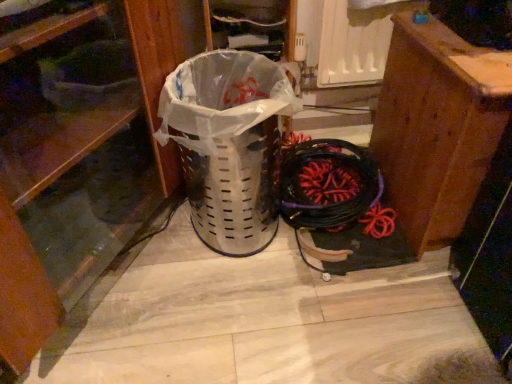
Question: Should I look upward or downward to see brushed wood dresser at left?

Choices:
 (A) up
 (B) down

Answer: (A)

Question: Does brown wood cabinet at right come behind brushed wood dresser at left?

Choices:
 (A) no
 (B) yes

Answer: (B)

Question: Is brown wood cabinet at right at the right side of brushed wood dresser at left?

Choices:
 (A) yes
 (B) no

Answer: (A)

Question: Does brown wood cabinet at right turn towards brushed wood dresser at left?

Choices:
 (A) yes
 (B) no

Answer: (B)

Question: Is brushed wood dresser at left inside brown wood cabinet at right?

Choices:
 (A) no
 (B) yes

Answer: (A)

Question: Is brown wood cabinet at right bigger than brushed wood dresser at left?

Choices:
 (A) yes
 (B) no

Answer: (B)

Question: Is brown wood cabinet at right to the left of brushed wood dresser at left from the viewer's perspective?

Choices:
 (A) yes
 (B) no

Answer: (B)

Question: From a real-world perspective, is brushed wood dresser at left positioned under brown wood cabinet at right based on gravity?

Choices:
 (A) no
 (B) yes

Answer: (A)

Question: Is brushed wood dresser at left far from brown wood cabinet at right?

Choices:
 (A) yes
 (B) no

Answer: (B)

Question: Is brushed wood dresser at left placed right next to brown wood cabinet at right?

Choices:
 (A) no
 (B) yes

Answer: (A)

Question: Can you confirm if brushed wood dresser at left is thinner than brown wood cabinet at right?

Choices:
 (A) no
 (B) yes

Answer: (A)

Question: From a real-world perspective, is brushed wood dresser at left on brown wood cabinet at right?

Choices:
 (A) yes
 (B) no

Answer: (A)

Question: Is brushed wood dresser at left closer to camera compared to brown wood cabinet at right?

Choices:
 (A) no
 (B) yes

Answer: (B)

Question: From the image's perspective, is brown wood cabinet at right above or below brushed wood dresser at left?

Choices:
 (A) above
 (B) below

Answer: (B)